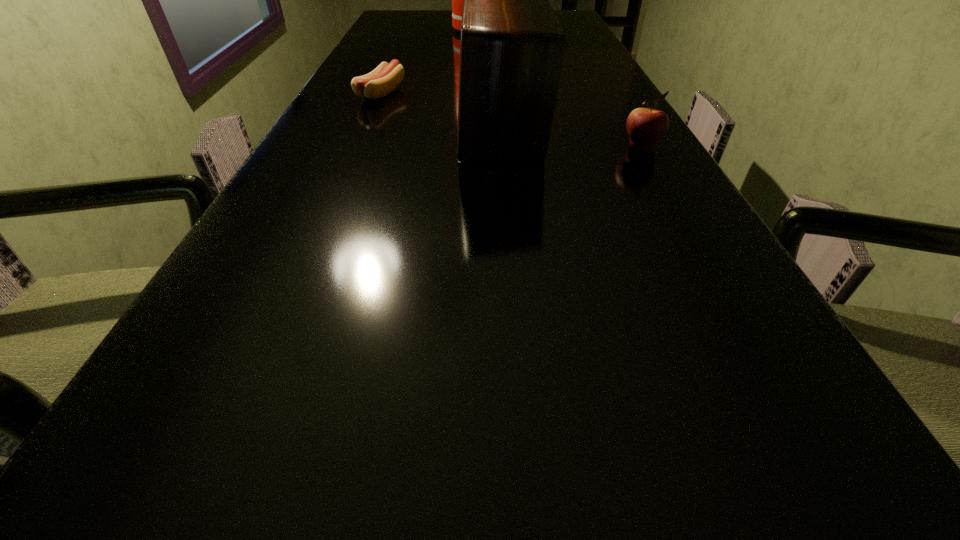
You are a GUI agent. You are given a task and a screenshot of the screen. Output one action in this format:
    pyautogui.click(x=<x>, y=<y>)
    Task: Click on the vacant area that lies between the radio receiver and the apple
    
    Given the screenshot: What is the action you would take?
    pyautogui.click(x=571, y=136)

Identify the location of vacant space in between the second shortest object and the second tallest object. (571, 136).

Image resolution: width=960 pixels, height=540 pixels. I want to click on free space between the rightmost object and the second tallest object, so (x=571, y=136).

Identify the location of empty location between the rightmost object and the second tallest object. (571, 136).

This screenshot has height=540, width=960. I want to click on vacant point located between the farthest object and the leftmost object, so click(426, 61).

Locate an element on the screen. This screenshot has height=540, width=960. vacant area that lies between the radio receiver and the leftmost object is located at coordinates (442, 108).

Where is `free space between the third shortest object and the rightmost object`? free space between the third shortest object and the rightmost object is located at coordinates (571, 136).

Choose which object is the nearest neighbor to the shortest object. Please provide its 2D coordinates. Your answer should be formatted as a tuple, i.e. [(x, y)], where the tuple contains the x and y coordinates of a point satisfying the conditions above.

[(512, 46)]

Locate which object is the second closest to the second shortest object. Please provide its 2D coordinates. Your answer should be formatted as a tuple, i.e. [(x, y)], where the tuple contains the x and y coordinates of a point satisfying the conditions above.

[(380, 82)]

This screenshot has width=960, height=540. I want to click on vacant space that satisfies the following two spatial constraints: 1. at the nozzle of the farthest object; 2. on the right side of the rightmost object, so click(466, 149).